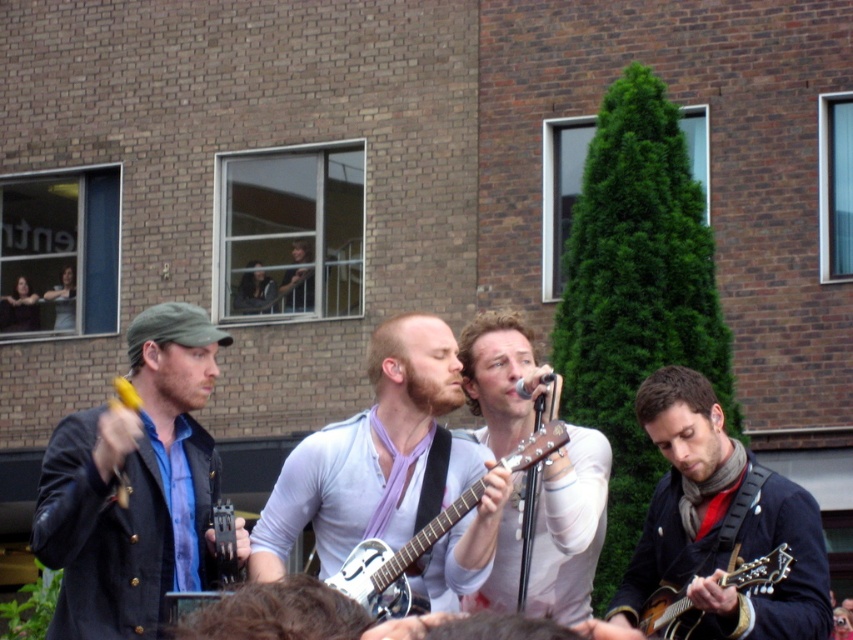
You are a photographer standing in front of the stage. You want to take a photo of both the white matte guitar at center and the metallic silver resonator guitar at center. Which guitar will appear larger in your photo?

The white matte guitar at center will appear larger in the photo because it is closer to the viewer than the metallic silver resonator guitar at center.

You are standing at the origin point in the image. Which of the two points, point (622, 609) or point (732, 579), is located farther away from you?

Point (622, 609) is behind point (732, 579), so it is farther away from you.